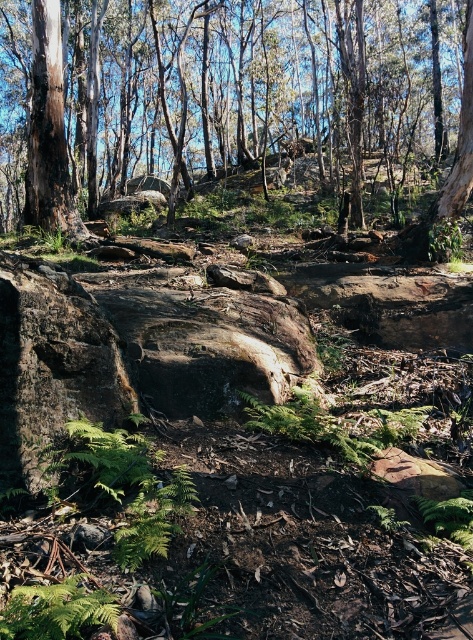
You are a hiker navigating through the forest and want to reach a clearing on the other side of the brown rough tree at center and the green leafy fern at lower left. Which object should you move past first to stay on the correct path?

You should move past the green leafy fern at lower left first because the brown rough tree at center is to the right of it, so the path would require passing the fern before the tree.

You are a hiker navigating through the forest and want to move from the point at coordinates point (309, 435) to the point at coordinates point (16, 600). Which direction should you move to get closer to your destination?

Since point (309, 435) is further to the viewer than point (16, 600), you should move forward towards the destination point (16, 600) to get closer.